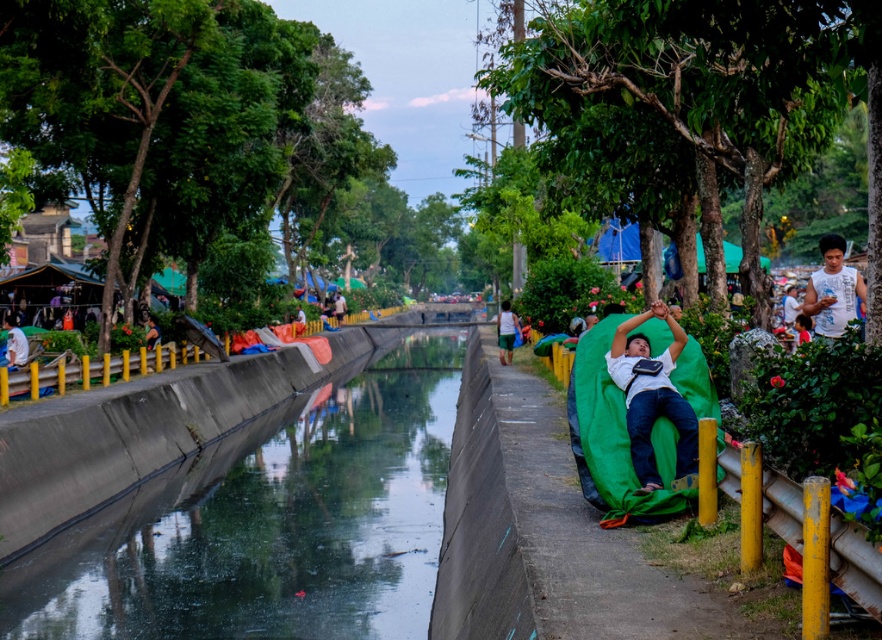
Question: Which of the following is the farthest from the observer?

Choices:
 (A) (21, 364)
 (B) (848, 276)

Answer: (A)

Question: Is white sleeveless shirt at right positioned at the back of white cotton shirt at left?

Choices:
 (A) no
 (B) yes

Answer: (A)

Question: Estimate the real-world distances between objects in this image. Which object is farther from the green fabric bag at center?

Choices:
 (A) smooth concrete canal at center
 (B) matte green cushion at right

Answer: (B)

Question: Observing the image, what is the correct spatial positioning of smooth concrete canal at center in reference to green fabric bag at center?

Choices:
 (A) above
 (B) below

Answer: (B)

Question: Is matte green cushion at right positioned behind white cotton shirt at left?

Choices:
 (A) no
 (B) yes

Answer: (A)

Question: Which object is farther from the camera taking this photo?

Choices:
 (A) green fabric bag at center
 (B) matte green cushion at right
 (C) white cotton shirt at left

Answer: (A)